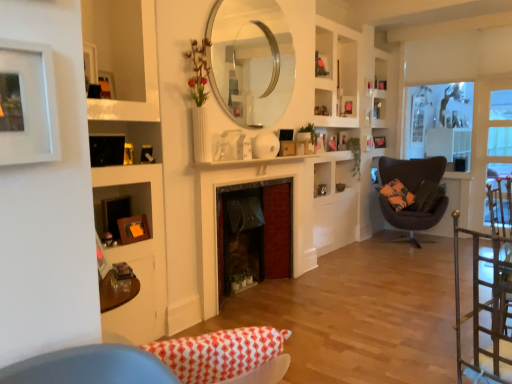
Question: Does point (504, 221) appear closer or farther from the camera than point (328, 147)?

Choices:
 (A) closer
 (B) farther

Answer: (A)

Question: Is clear glass window screen at right wider or thinner than wooden picture frame at center, the 4th picture frame when ordered from back to front?

Choices:
 (A) wide
 (B) thin

Answer: (A)

Question: Considering the real-world distances, which object is farthest from the orange matte picture frame at lower left, marked as the 1th picture frame in a left-to-right arrangement?

Choices:
 (A) wooden picture frame at upper center, marked as the 4th picture frame in a top-to-bottom arrangement
 (B) wooden picture frame at upper right, the 1th picture frame from the right
 (C) clear glass mirror at upper center
 (D) brick fireplace at center
 (E) wooden picture frame at center, marked as the third picture frame in a bottom-to-top arrangement

Answer: (B)

Question: Which object is positioned farthest from the clear glass window screen at right?

Choices:
 (A) orange matte picture frame at lower left, which is counted as the 8th picture frame, starting from the right
 (B) metallic gold chair at right, acting as the 2th chair starting from the back
 (C) wooden picture frame at upper center, positioned as the 8th picture frame in bottom-to-top order
 (D) matte black picture frame at upper right, which is the 2th picture frame in right-to-left order
 (E) dark gray fabric pillow at right

Answer: (A)